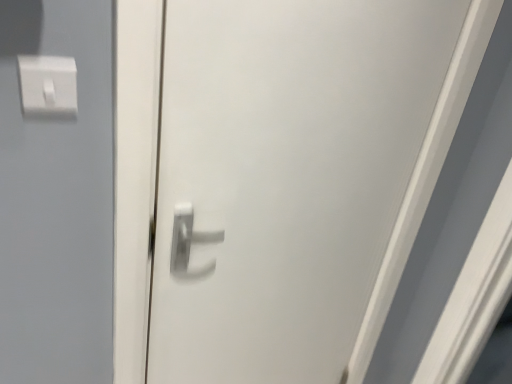
Question: Is white glossy door handle at center in front of or behind white plastic light switch at upper left in the image?

Choices:
 (A) front
 (B) behind

Answer: (A)

Question: Is white glossy door handle at center wider or thinner than white plastic light switch at upper left?

Choices:
 (A) thin
 (B) wide

Answer: (B)

Question: Visually, is white glossy door handle at center positioned to the left or to the right of white plastic light switch at upper left?

Choices:
 (A) left
 (B) right

Answer: (B)

Question: From a real-world perspective, relative to white glossy door handle at center, is white plastic light switch at upper left vertically above or below?

Choices:
 (A) above
 (B) below

Answer: (A)

Question: From the image's perspective, relative to white glossy door handle at center, is white plastic light switch at upper left above or below?

Choices:
 (A) above
 (B) below

Answer: (A)

Question: Is white plastic light switch at upper left situated inside white glossy door handle at center or outside?

Choices:
 (A) inside
 (B) outside

Answer: (B)

Question: Considering the relative positions of white plastic light switch at upper left and white glossy door handle at center in the image provided, is white plastic light switch at upper left to the left or to the right of white glossy door handle at center?

Choices:
 (A) right
 (B) left

Answer: (B)